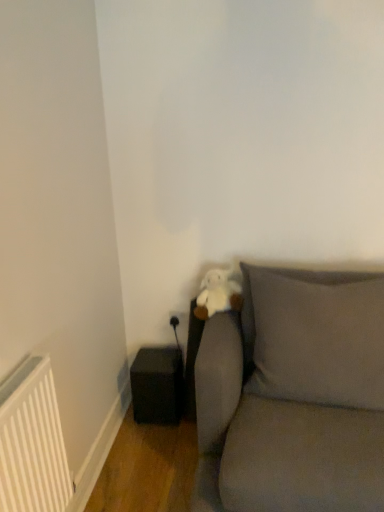
Question: Considering the relative sizes of matte gray pillow at center and gray fabric couch at lower right in the image provided, is matte gray pillow at center thinner than gray fabric couch at lower right?

Choices:
 (A) no
 (B) yes

Answer: (B)

Question: Considering the relative sizes of matte gray pillow at center and gray fabric couch at lower right in the image provided, is matte gray pillow at center smaller than gray fabric couch at lower right?

Choices:
 (A) no
 (B) yes

Answer: (B)

Question: Does matte gray pillow at center have a greater height compared to gray fabric couch at lower right?

Choices:
 (A) yes
 (B) no

Answer: (B)

Question: Is matte gray pillow at center closer to camera compared to gray fabric couch at lower right?

Choices:
 (A) yes
 (B) no

Answer: (B)

Question: From the image's perspective, is matte gray pillow at center beneath gray fabric couch at lower right?

Choices:
 (A) no
 (B) yes

Answer: (A)

Question: In the image, is black matte speaker at lower left positioned in front of or behind matte gray pillow at center?

Choices:
 (A) behind
 (B) front

Answer: (A)

Question: From the image's perspective, is black matte speaker at lower left above or below matte gray pillow at center?

Choices:
 (A) above
 (B) below

Answer: (B)

Question: In terms of height, does black matte speaker at lower left look taller or shorter compared to matte gray pillow at center?

Choices:
 (A) tall
 (B) short

Answer: (B)

Question: Is point (170, 382) positioned closer to the camera than point (375, 395)?

Choices:
 (A) farther
 (B) closer

Answer: (A)

Question: Is matte gray pillow at center wider or thinner than gray fabric couch at lower right?

Choices:
 (A) thin
 (B) wide

Answer: (A)

Question: Is matte gray pillow at center taller or shorter than gray fabric couch at lower right?

Choices:
 (A) short
 (B) tall

Answer: (A)

Question: Based on their positions, is matte gray pillow at center located to the left or right of gray fabric couch at lower right?

Choices:
 (A) right
 (B) left

Answer: (A)

Question: In the image, is matte gray pillow at center positioned in front of or behind gray fabric couch at lower right?

Choices:
 (A) behind
 (B) front

Answer: (A)

Question: Is gray fabric couch at lower right bigger or smaller than black matte speaker at lower left?

Choices:
 (A) small
 (B) big

Answer: (B)

Question: Relative to black matte speaker at lower left, is gray fabric couch at lower right in front or behind?

Choices:
 (A) front
 (B) behind

Answer: (A)